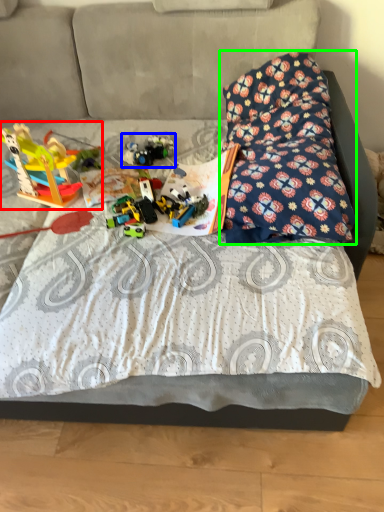
Question: Estimate the real-world distances between objects in this image. Which object is closer to toy (highlighted by a red box), toy (highlighted by a blue box) or pillow (highlighted by a green box)?

Choices:
 (A) toy
 (B) pillow

Answer: (A)